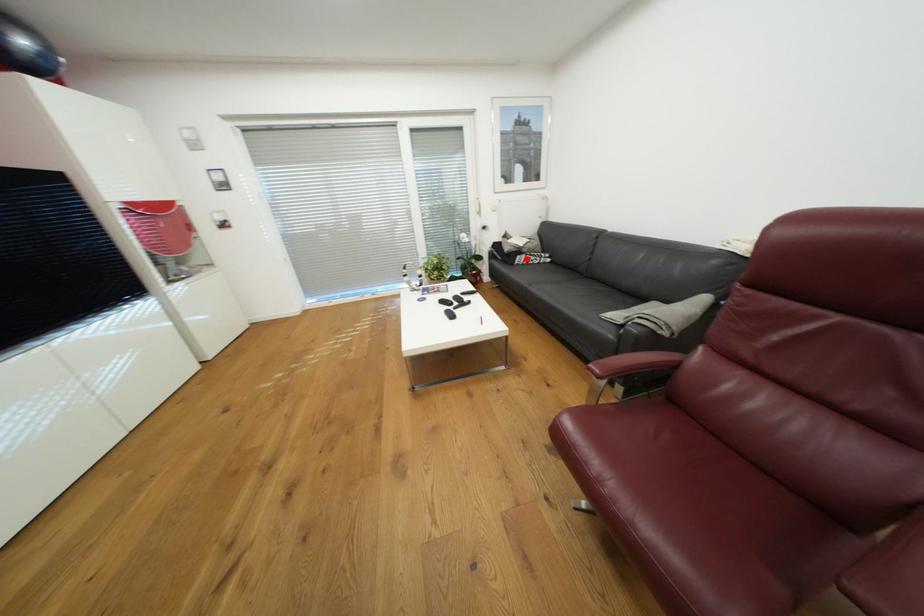
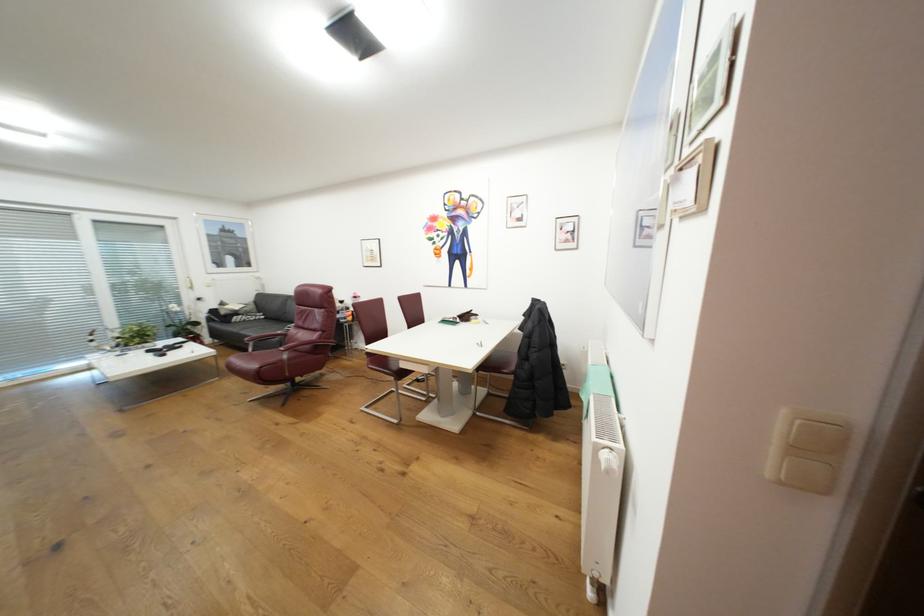
Where in the second image is the point corresponding to the highlighted location from the first image?

(244, 318)